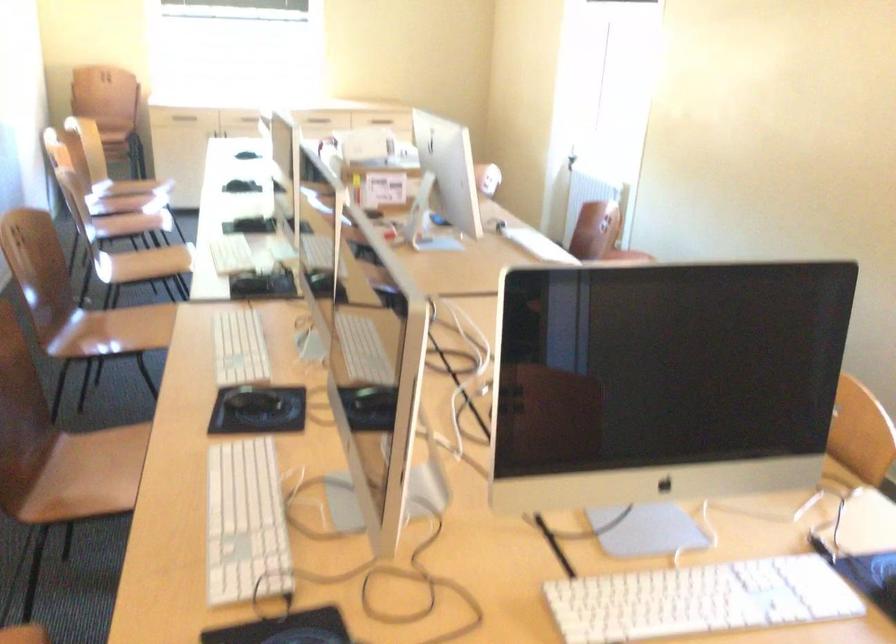
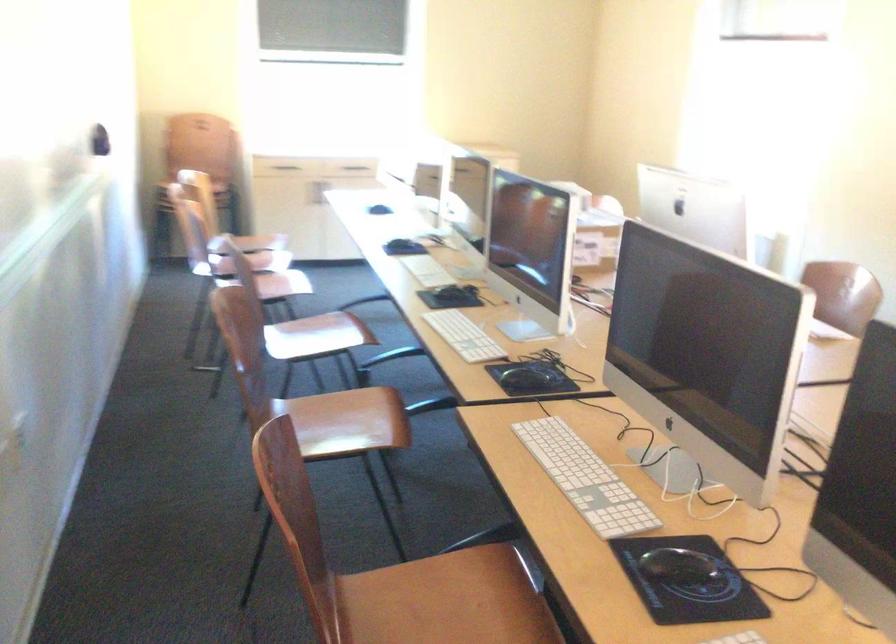
The images are taken continuously from a first-person perspective. In which direction are you moving?

The movement direction of the cameraman is left, forward.